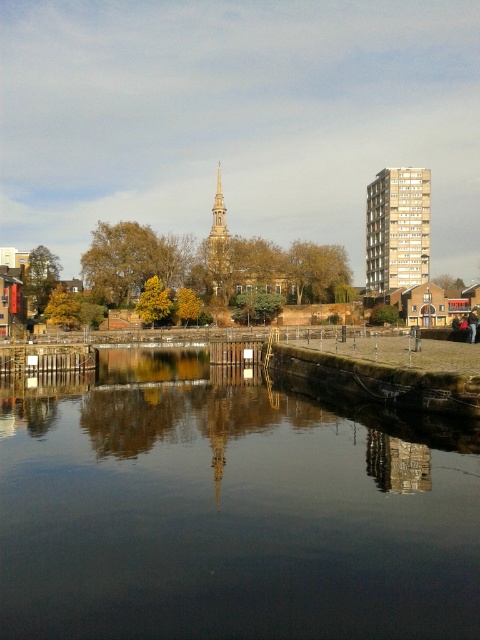
Who is more distant from viewer, (x=400, y=276) or (x=219, y=188)?

The point (x=219, y=188) is more distant.

Is gold metallic building at upper right bigger than gold textured spire at center?

No.

Does point (369, 205) lie in front of point (216, 198)?

Yes, point (369, 205) is in front of point (216, 198).

This screenshot has height=640, width=480. Find the location of `gold metallic building at upper right`. gold metallic building at upper right is located at coordinates (397, 228).

Is dark reflective water at center to the left of gold textured spire at center from the viewer's perspective?

Incorrect, dark reflective water at center is not on the left side of gold textured spire at center.

Find the location of a particular element. dark reflective water at center is located at coordinates (228, 509).

Which is more to the right, dark reflective water at center or gold metallic building at upper right?

gold metallic building at upper right is more to the right.

Between dark reflective water at center and gold metallic building at upper right, which one has less height?

Standing shorter between the two is dark reflective water at center.

Does point (183, 545) lie in front of point (385, 259)?

That is True.

The height and width of the screenshot is (640, 480). I want to click on dark reflective water at center, so click(228, 509).